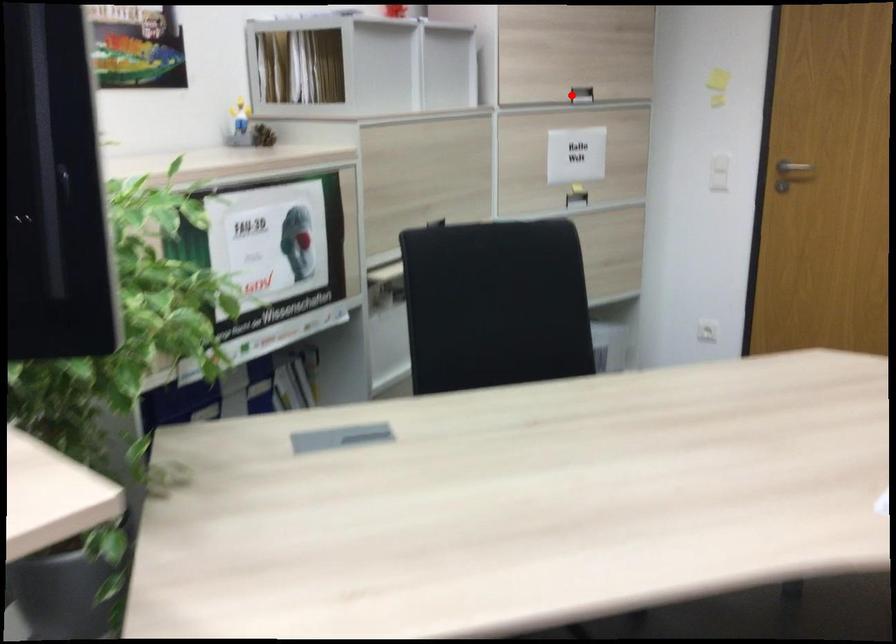
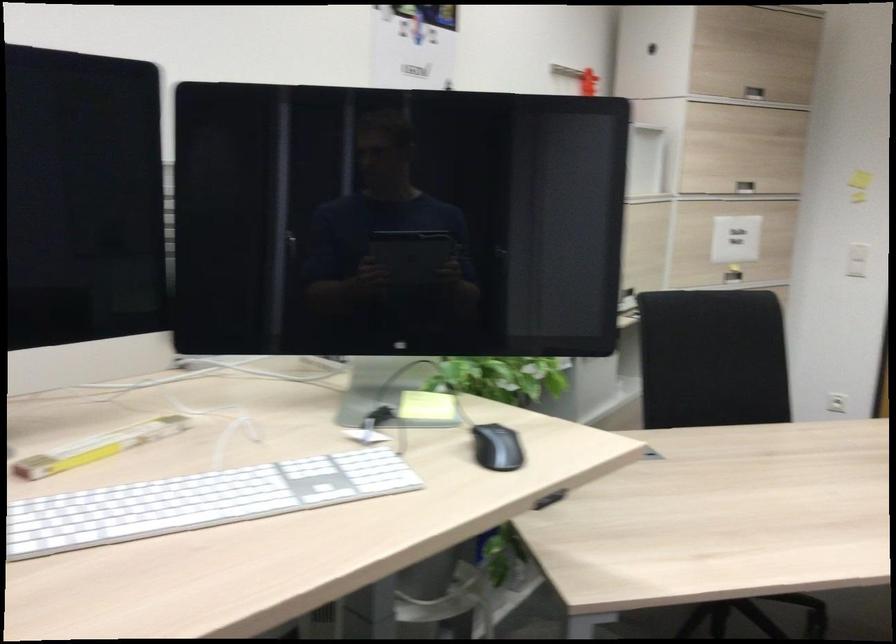
Question: I am providing you with two images of the same scene from different viewpoints. A red point is shown in image1. For the corresponding object point in image2, is it positioned nearer or farther from the camera?

Choices:
 (A) Nearer
 (B) Farther

Answer: (B)